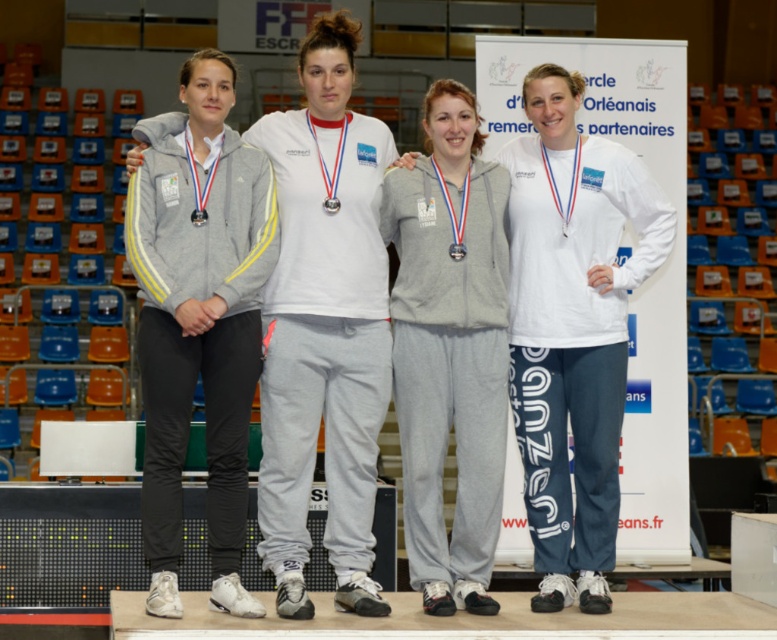
You are a photographer taking a picture of the athletes on the podium. You notice the gray fleece sweatshirt at center and the gray heathered tracksuit at center. Which one is positioned higher in the image?

The gray fleece sweatshirt at center is positioned higher in the image than the gray heathered tracksuit at center because it is above it.

You are a photographer standing in front of the podium with the four athletes. You need to take a photo that includes both the gray fleece sweatshirt at center and the gray heathered tracksuit at center. Given that your camera has a 18 inch wide lens, will you be able to fit both items into the frame without moving closer or farther away?

The gray fleece sweatshirt at center is 21.09 inches away from the gray heathered tracksuit at center. Since the distance between them exceeds the camera lens width of 18 inches, you cannot fit both items into the frame without adjusting your position.

You are standing in front of the podium with the four athletes. You notice two points marked on the podium. The first point is at coordinates point [605,321] and the second is at point [451,250]. Which point is closer to you?

Point [605,321] is closer to you because it is further to the viewer than point [451,250].